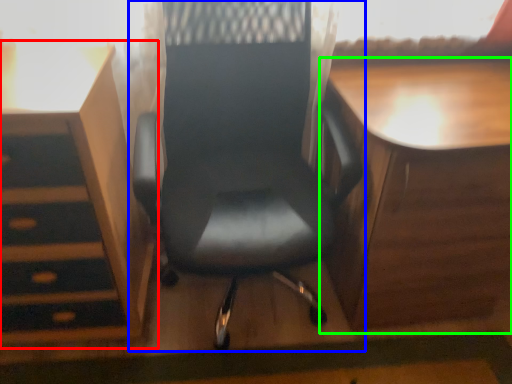
Question: Which object is positioned farthest from vanity (highlighted by a red box)? Select from chair (highlighted by a blue box) and table (highlighted by a green box).

Choices:
 (A) chair
 (B) table

Answer: (B)